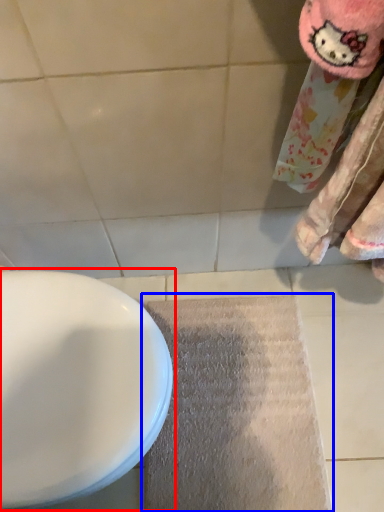
Question: Among these objects, which one is nearest to the camera, toilet (highlighted by a red box) or doormat (highlighted by a blue box)?

Choices:
 (A) toilet
 (B) doormat

Answer: (A)